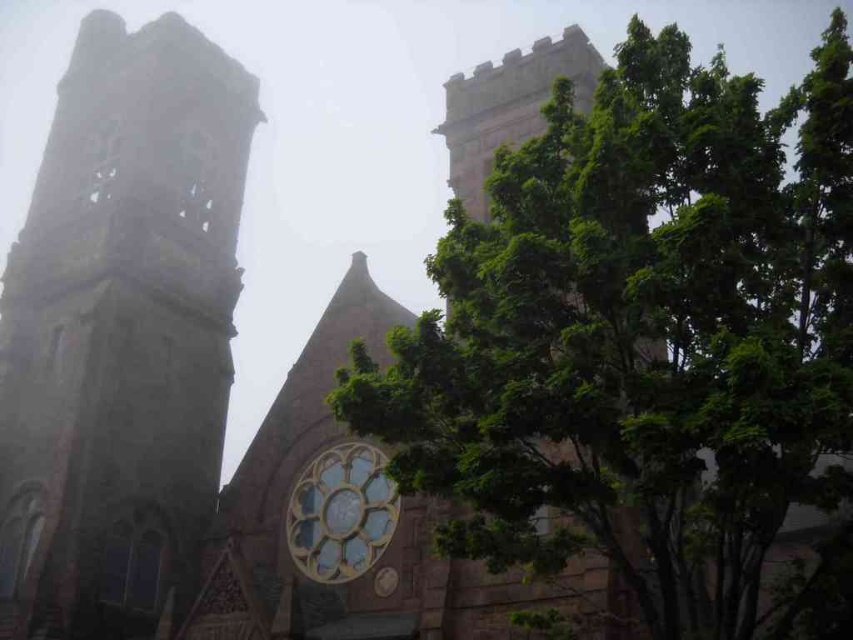
Can you confirm if green leafy tree at upper center is positioned above golden stained glass clock at center?

Indeed, green leafy tree at upper center is positioned over golden stained glass clock at center.

Which of these two, green leafy tree at upper center or golden stained glass clock at center, stands shorter?

golden stained glass clock at center is shorter.

Locate an element on the screen. green leafy tree at upper center is located at coordinates (643, 342).

Is point (618, 196) behind point (107, 401)?

No, it is not.

Between point (595, 164) and point (64, 310), which one is positioned in front?

Positioned in front is point (595, 164).

Find the location of a particular element. This screenshot has width=853, height=640. green leafy tree at upper center is located at coordinates (643, 342).

Find the location of a particular element. Image resolution: width=853 pixels, height=640 pixels. green leafy tree at upper center is located at coordinates (643, 342).

What do you see at coordinates (120, 333) in the screenshot? This screenshot has width=853, height=640. I see `stone tower at left` at bounding box center [120, 333].

Can you confirm if stone tower at left is shorter than golden stained glass clock at center?

No.

Who is more forward, (204, 477) or (328, 577)?

Positioned in front is point (328, 577).

The image size is (853, 640). I want to click on stone tower at left, so click(x=120, y=333).